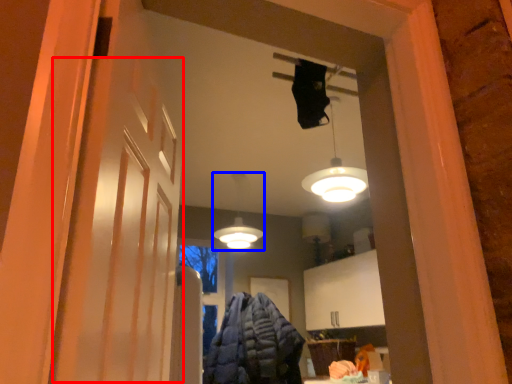
Question: Which object is closer to the camera taking this photo, barn door (highlighted by a red box) or lamp (highlighted by a blue box)?

Choices:
 (A) barn door
 (B) lamp

Answer: (A)